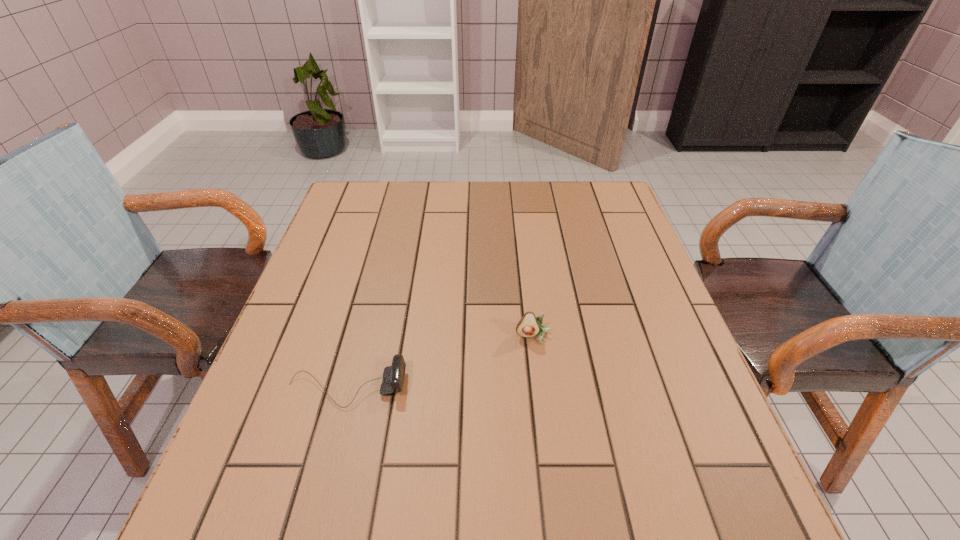
Find the location of a particular element. Image resolution: width=960 pixels, height=540 pixels. free region at the right edge of the desktop is located at coordinates (661, 289).

At what (x,y) coordinates should I click in order to perform the action: click on free region at the far left corner. Please return your answer as a coordinate pair (x, y). This screenshot has height=540, width=960. Looking at the image, I should click on (337, 201).

The width and height of the screenshot is (960, 540). What are the coordinates of `vacant space at the far right corner of the desktop` in the screenshot? It's located at (588, 217).

Identify the location of free space that satisfies the following two spatial constraints: 1. on the seed side of the taller object; 2. on the front-facing side of the webcam. The image size is (960, 540). (540, 388).

Find the location of a particular element. vacant space that satisfies the following two spatial constraints: 1. on the seed side of the avocado; 2. on the front-facing side of the shorter object is located at coordinates (540, 388).

Where is `vacant region that satisfies the following two spatial constraints: 1. on the seed side of the avocado; 2. on the front-facing side of the left object`? This screenshot has width=960, height=540. vacant region that satisfies the following two spatial constraints: 1. on the seed side of the avocado; 2. on the front-facing side of the left object is located at coordinates (540, 388).

Where is `free space that satisfies the following two spatial constraints: 1. on the seed side of the avocado; 2. on the front-facing side of the shorter object`? This screenshot has width=960, height=540. free space that satisfies the following two spatial constraints: 1. on the seed side of the avocado; 2. on the front-facing side of the shorter object is located at coordinates (540, 388).

Identify the location of free space that satisfies the following two spatial constraints: 1. on the seed side of the avocado; 2. on the front-facing side of the left object. This screenshot has height=540, width=960. (540, 388).

What are the coordinates of `vacant region that satisfies the following two spatial constraints: 1. on the seed side of the avocado; 2. on the front-facing side of the webcam` in the screenshot? It's located at (540, 388).

You are a GUI agent. You are given a task and a screenshot of the screen. Output one action in this format:
    pyautogui.click(x=<x>, y=<y>)
    Task: Click on the vacant space that satisfies the following two spatial constraints: 1. on the seed side of the taller object; 2. on the front-facing side of the left object
    
    Given the screenshot: What is the action you would take?
    pyautogui.click(x=540, y=388)